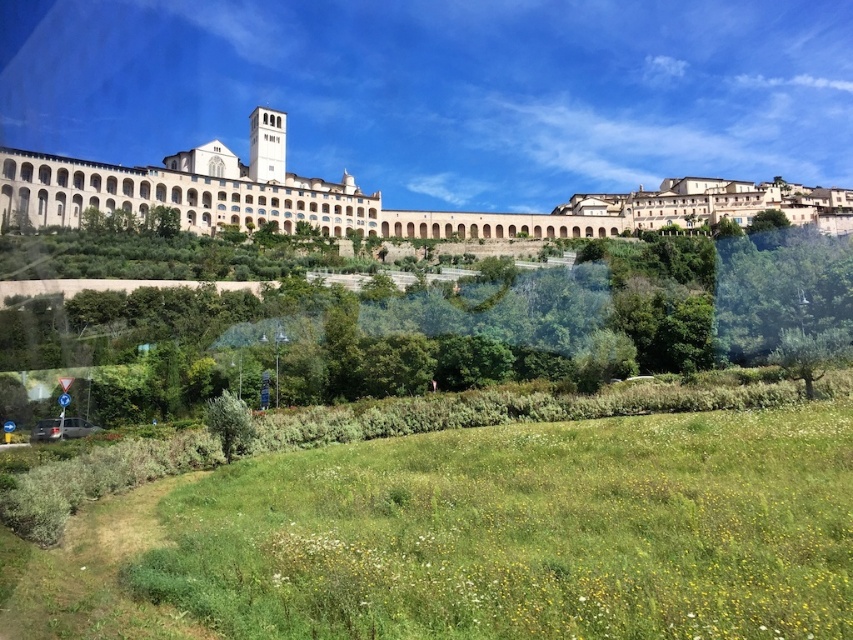
Who is positioned more to the left, green leafy tree at center or white stone building at upper center?

green leafy tree at center

Is green leafy tree at center positioned before white stone building at upper center?

Yes, it is.

Between point (849, 280) and point (173, 164), which one is positioned behind?

Positioned behind is point (173, 164).

You are a GUI agent. You are given a task and a screenshot of the screen. Output one action in this format:
    pyautogui.click(x=<x>, y=<y>)
    Task: Click on the green leafy tree at center
    
    Given the screenshot: What is the action you would take?
    pyautogui.click(x=444, y=324)

Is point (796, 499) less distant than point (270, 355)?

That is True.

Between green grassy field at lower center and green leafy tree at center, which one is positioned lower?

Positioned lower is green grassy field at lower center.

You are a GUI agent. You are given a task and a screenshot of the screen. Output one action in this format:
    pyautogui.click(x=<x>, y=<y>)
    Task: Click on the green grassy field at lower center
    The width and height of the screenshot is (853, 640).
    Given the screenshot: What is the action you would take?
    pyautogui.click(x=480, y=536)

From the picture: Can you confirm if green grassy field at lower center is taller than white stone building at upper center?

No.

Does green grassy field at lower center lie behind white stone building at upper center?

No, it is in front of white stone building at upper center.

Image resolution: width=853 pixels, height=640 pixels. Identify the location of green grassy field at lower center. (480, 536).